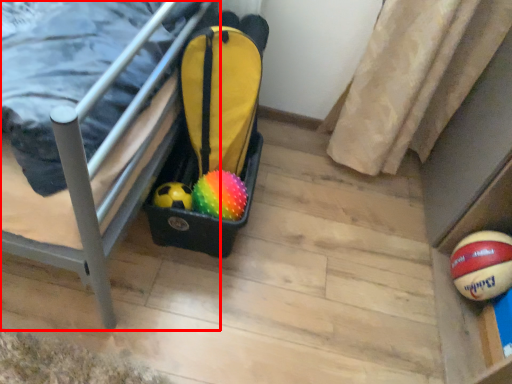
Question: From the image, what is the correct spatial relationship of furniture (annotated by the red box) in relation to ball?

Choices:
 (A) right
 (B) left

Answer: (B)